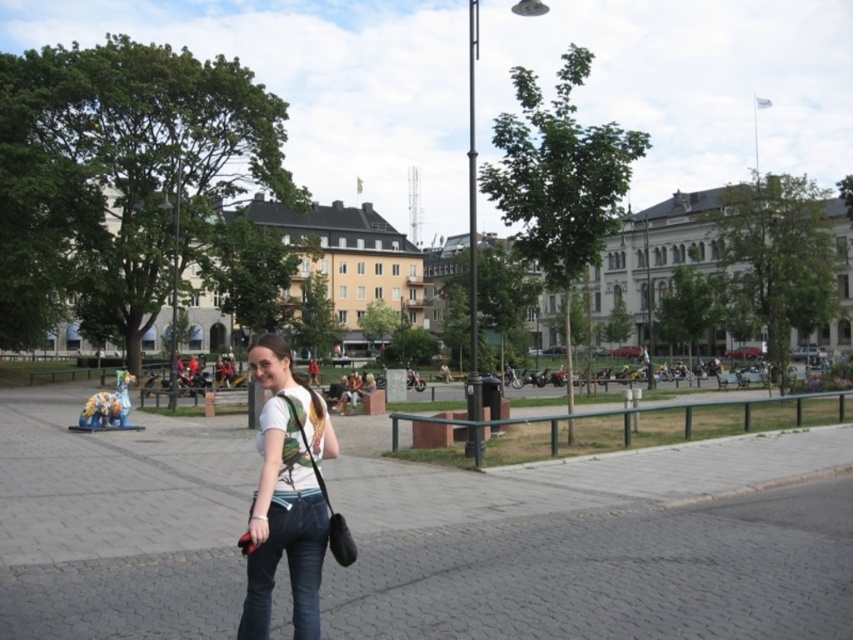
Does gray concrete pavement at center have a smaller size compared to white matte t-shirt at center?

Actually, gray concrete pavement at center might be larger than white matte t-shirt at center.

Which is in front, point (598, 547) or point (260, 436)?

Point (260, 436) is more forward.

Is point (175, 458) in front of point (248, 579)?

No, (175, 458) is further to viewer.

Locate an element on the screen. This screenshot has height=640, width=853. gray concrete pavement at center is located at coordinates (596, 547).

Who is positioned more to the right, gray concrete pavement at center or black leather shoulder bag at center?

Positioned to the right is black leather shoulder bag at center.

What do you see at coordinates (596, 547) in the screenshot?
I see `gray concrete pavement at center` at bounding box center [596, 547].

The height and width of the screenshot is (640, 853). Find the location of `gray concrete pavement at center`. gray concrete pavement at center is located at coordinates (596, 547).

Between point (268, 490) and point (323, 497), which one is positioned in front?

Point (268, 490) is in front.

Locate an element on the screen. This screenshot has width=853, height=640. white matte t-shirt at center is located at coordinates (286, 493).